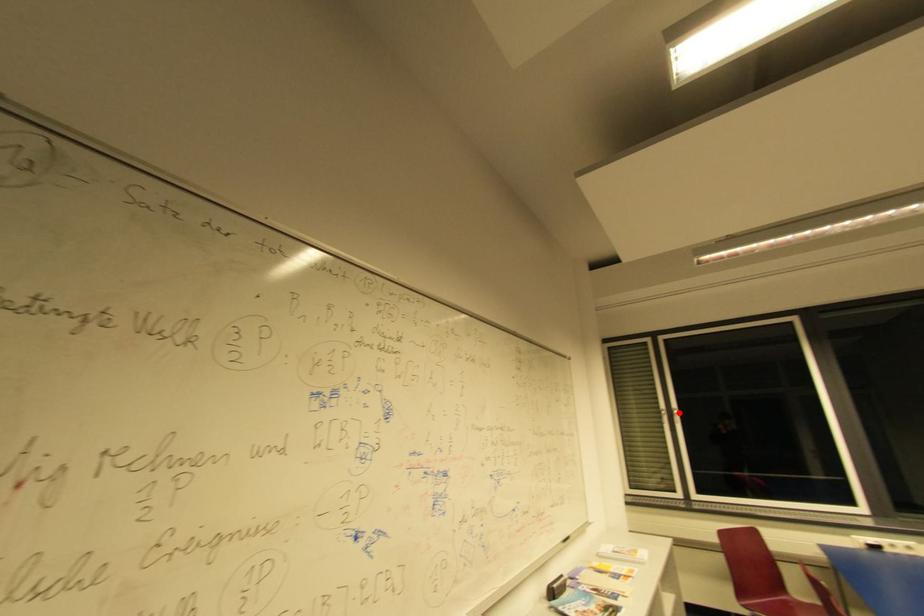
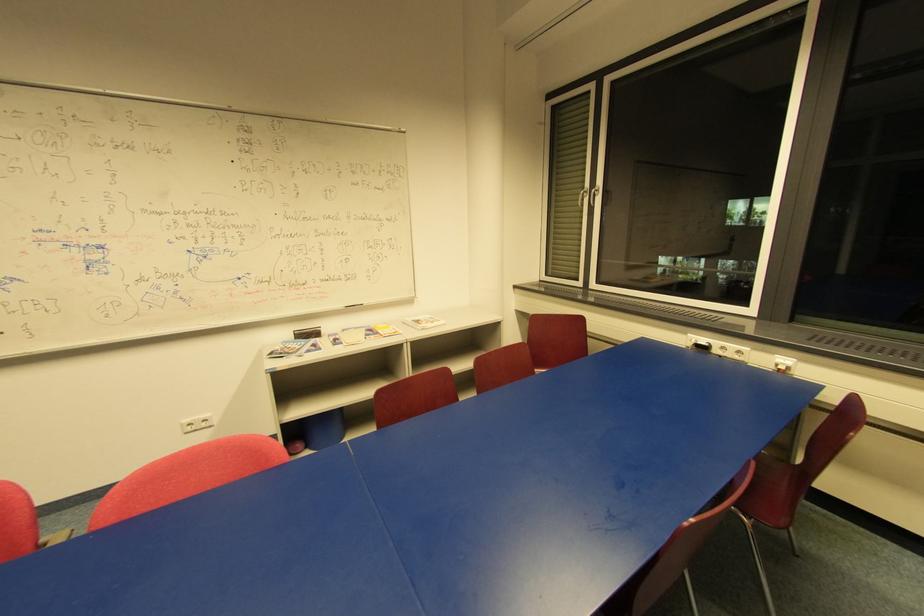
Locate, in the second image, the point that corresponds to the highlighted location in the first image.

(598, 192)